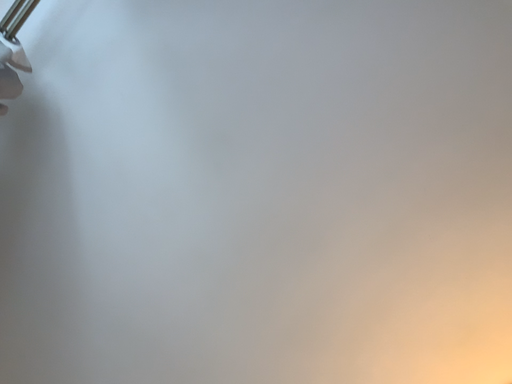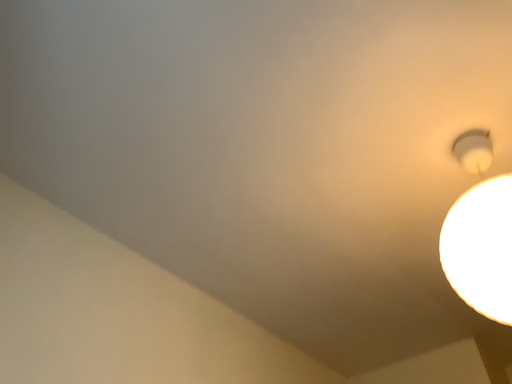
Question: How did the camera likely rotate when shooting the video?

Choices:
 (A) rotated downward
 (B) rotated upward

Answer: (A)